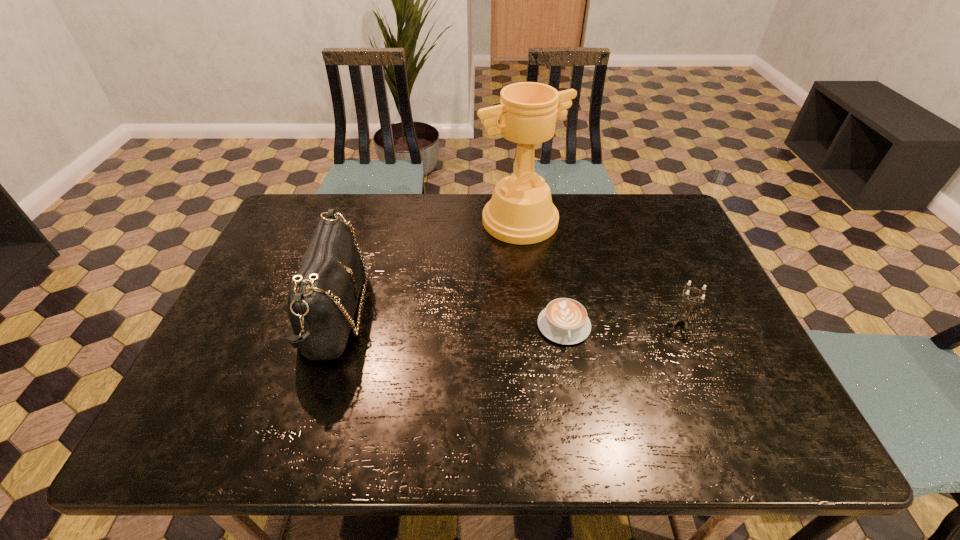
Where is `free space located on the side of the shortest object with the handle`? free space located on the side of the shortest object with the handle is located at coordinates (581, 424).

Where is `object at the far edge`? Image resolution: width=960 pixels, height=540 pixels. object at the far edge is located at coordinates (521, 211).

The width and height of the screenshot is (960, 540). I want to click on object at the right edge, so click(682, 317).

Identify the location of vacant region at the far edge. This screenshot has height=540, width=960. (630, 238).

Find the location of a particular element. This screenshot has height=540, width=960. vacant area at the near edge is located at coordinates (338, 430).

Where is `vacant area at the left edge`? vacant area at the left edge is located at coordinates (238, 362).

At what (x,y) coordinates should I click in order to perform the action: click on free point at the right edge. Please return your answer as a coordinate pair (x, y). Looking at the image, I should click on (685, 255).

In the image, there is a desktop. In order to click on vacant space at the far right corner in this screenshot , I will do `click(663, 226)`.

This screenshot has width=960, height=540. What are the coordinates of `vacant space that's between the handbag and the shortest object` in the screenshot? It's located at (449, 320).

The width and height of the screenshot is (960, 540). I want to click on free space between the rightmost object and the farthest object, so click(x=601, y=272).